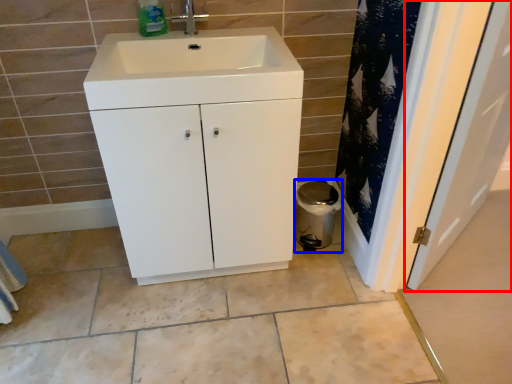
Question: Which object appears closest to the camera in this image, door (highlighted by a red box) or appliance (highlighted by a blue box)?

Choices:
 (A) door
 (B) appliance

Answer: (A)